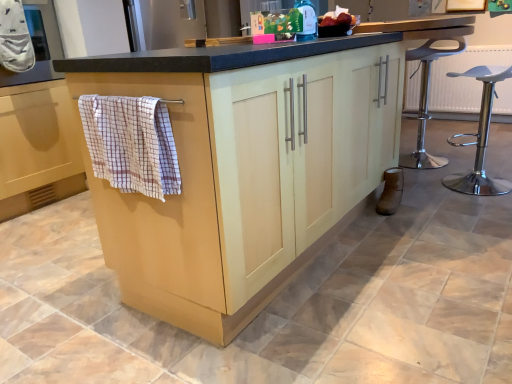
You are a GUI agent. You are given a task and a screenshot of the screen. Output one action in this format:
    pyautogui.click(x=<x>, y=<y>)
    Task: Click on the vacant area that is in front of brown suede boot at lower right
    Image resolution: width=512 pixels, height=384 pixels.
    Given the screenshot: What is the action you would take?
    pyautogui.click(x=401, y=221)